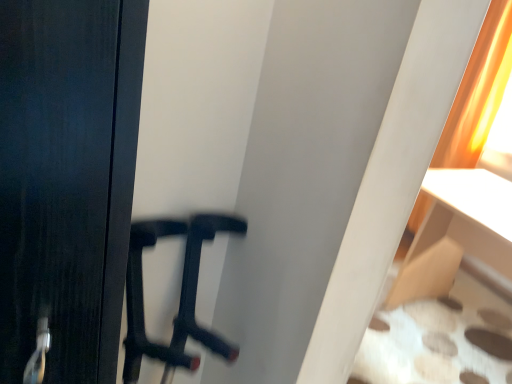
This screenshot has width=512, height=384. I want to click on white fabric ottoman at lower right, so click(x=456, y=232).

What is the approximate width of white fabric ottoman at lower right?

28.41 inches.

This screenshot has height=384, width=512. What do you see at coordinates (456, 232) in the screenshot?
I see `white fabric ottoman at lower right` at bounding box center [456, 232].

Where is `orange fabric curtain at upper right`? The width and height of the screenshot is (512, 384). orange fabric curtain at upper right is located at coordinates (478, 92).

The image size is (512, 384). What do you see at coordinates (478, 92) in the screenshot? I see `orange fabric curtain at upper right` at bounding box center [478, 92].

Where is `white fabric ottoman at lower right`? The width and height of the screenshot is (512, 384). white fabric ottoman at lower right is located at coordinates (456, 232).

Visually, is white fabric ottoman at lower right positioned to the left or to the right of orange fabric curtain at upper right?

Based on their positions, white fabric ottoman at lower right is located to the left of orange fabric curtain at upper right.

Considering the positions of objects white fabric ottoman at lower right and orange fabric curtain at upper right in the image provided, who is behind, white fabric ottoman at lower right or orange fabric curtain at upper right?

Positioned behind is orange fabric curtain at upper right.

Is point (471, 214) farther from viewer compared to point (476, 146)?

No, (471, 214) is in front of (476, 146).

From the image's perspective, is white fabric ottoman at lower right on top of orange fabric curtain at upper right?

No.

From a real-world perspective, which is physically above, white fabric ottoman at lower right or orange fabric curtain at upper right?

orange fabric curtain at upper right is physically above.

Between white fabric ottoman at lower right and orange fabric curtain at upper right, which one has smaller width?

orange fabric curtain at upper right.

Does white fabric ottoman at lower right have a greater height compared to orange fabric curtain at upper right?

No, white fabric ottoman at lower right is not taller than orange fabric curtain at upper right.

Does white fabric ottoman at lower right have a smaller size compared to orange fabric curtain at upper right?

Actually, white fabric ottoman at lower right might be larger than orange fabric curtain at upper right.

Can orange fabric curtain at upper right be found inside white fabric ottoman at lower right?

No, white fabric ottoman at lower right does not contain orange fabric curtain at upper right.

Would you say white fabric ottoman at lower right is a long distance from orange fabric curtain at upper right?

white fabric ottoman at lower right is near orange fabric curtain at upper right, not far away.

Is white fabric ottoman at lower right aimed at orange fabric curtain at upper right?

No, white fabric ottoman at lower right is not aimed at orange fabric curtain at upper right.

How many degrees apart are the facing directions of white fabric ottoman at lower right and orange fabric curtain at upper right?

2.8 degrees.

Identify the location of furniture below the orange fabric curtain at upper right (from the image's perspective). (456, 232).

Does orange fabric curtain at upper right appear on the right side of white fabric ottoman at lower right?

Yes, orange fabric curtain at upper right is to the right of white fabric ottoman at lower right.

Does orange fabric curtain at upper right lie behind white fabric ottoman at lower right?

Yes, it is.

Which point is more forward, (465, 150) or (476, 205)?

The point (476, 205) is closer to the camera.

From the image's perspective, which one is positioned lower, orange fabric curtain at upper right or white fabric ottoman at lower right?

From the image's view, white fabric ottoman at lower right is below.

Consider the image. From a real-world perspective, which is physically above, orange fabric curtain at upper right or white fabric ottoman at lower right?

orange fabric curtain at upper right, from a real-world perspective.

Is orange fabric curtain at upper right thinner than white fabric ottoman at lower right?

Yes, orange fabric curtain at upper right is thinner than white fabric ottoman at lower right.

Between orange fabric curtain at upper right and white fabric ottoman at lower right, which one has less height?

With less height is white fabric ottoman at lower right.

Considering the relative sizes of orange fabric curtain at upper right and white fabric ottoman at lower right in the image provided, is orange fabric curtain at upper right bigger than white fabric ottoman at lower right?

Actually, orange fabric curtain at upper right might be smaller than white fabric ottoman at lower right.

Would you say white fabric ottoman at lower right is part of orange fabric curtain at upper right's contents?

No, white fabric ottoman at lower right is not surrounded by orange fabric curtain at upper right.

In the scene shown: Is there a large distance between orange fabric curtain at upper right and white fabric ottoman at lower right?

No, orange fabric curtain at upper right is not far away from white fabric ottoman at lower right.

Could you tell me if orange fabric curtain at upper right is facing white fabric ottoman at lower right?

No.

Where is `furniture that appears below the orange fabric curtain at upper right (from the image's perspective)`? furniture that appears below the orange fabric curtain at upper right (from the image's perspective) is located at coordinates (456, 232).

At what (x,y) coordinates should I click in order to perform the action: click on furniture located in front of the orange fabric curtain at upper right. Please return your answer as a coordinate pair (x, y). This screenshot has height=384, width=512. Looking at the image, I should click on (456, 232).

The image size is (512, 384). I want to click on curtain on the right of white fabric ottoman at lower right, so click(x=478, y=92).